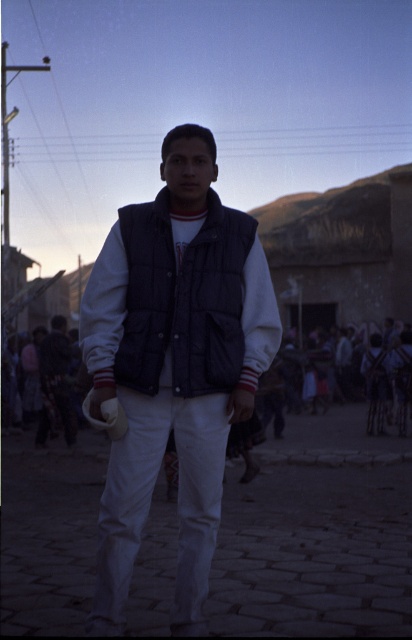
Question: Can you confirm if matte blue vest at center is smaller than dark blue quilted vest at center?

Choices:
 (A) yes
 (B) no

Answer: (B)

Question: Which point is closer to the camera?

Choices:
 (A) dark blue quilted vest at center
 (B) matte blue vest at center
 (C) dark blue denim vest at center
 (D) white cotton crowd at center

Answer: (B)

Question: Can you confirm if matte blue vest at center is positioned below matte white hand at center?

Choices:
 (A) yes
 (B) no

Answer: (B)

Question: Can you confirm if matte blue vest at center is positioned to the left of dark blue denim vest at center?

Choices:
 (A) no
 (B) yes

Answer: (A)

Question: Which point is closer to the camera?

Choices:
 (A) (250, 412)
 (B) (123, 465)

Answer: (B)

Question: Which of the following is the farthest from the observer?

Choices:
 (A) white cotton crowd at center
 (B) matte white hand at center
 (C) dark blue quilted vest at center

Answer: (A)